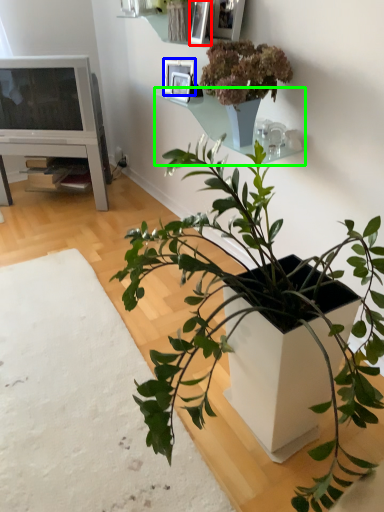
Question: Which is nearer to the picture frame (highlighted by a red box)? picture frame (highlighted by a blue box) or shelf (highlighted by a green box).

Choices:
 (A) picture frame
 (B) shelf

Answer: (A)